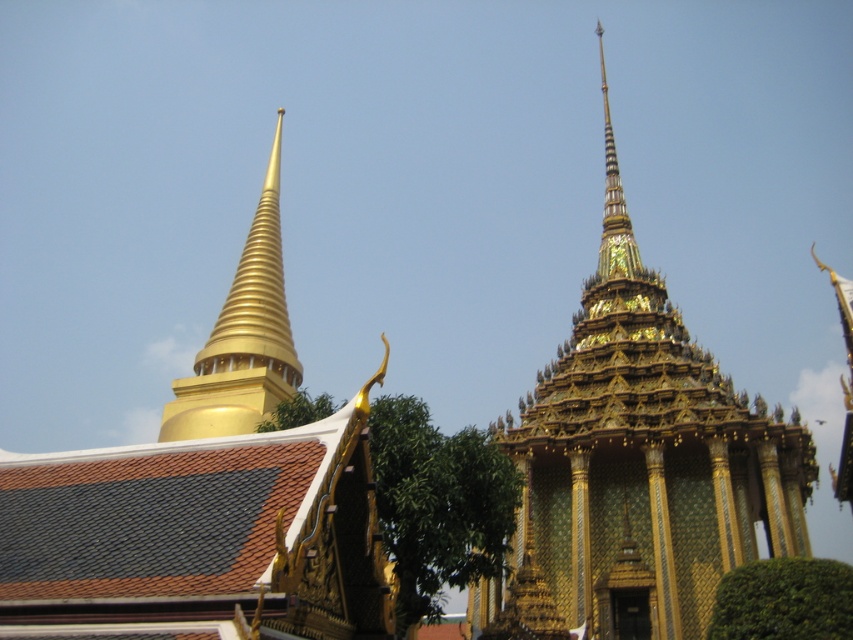
Is gold mosaic temple at center to the left of gold polished spire at upper left from the viewer's perspective?

No, gold mosaic temple at center is not to the left of gold polished spire at upper left.

Based on the photo, can you confirm if gold mosaic temple at center is smaller than gold polished spire at upper left?

No, gold mosaic temple at center is not smaller than gold polished spire at upper left.

The width and height of the screenshot is (853, 640). I want to click on gold mosaic temple at center, so click(x=637, y=465).

Find the location of a particular element. gold mosaic temple at center is located at coordinates (637, 465).